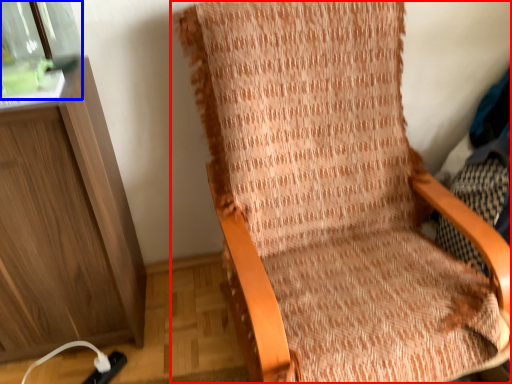
Question: Which object appears closest to the camera in this image, chair (highlighted by a red box) or glass jar (highlighted by a blue box)?

Choices:
 (A) chair
 (B) glass jar

Answer: (A)